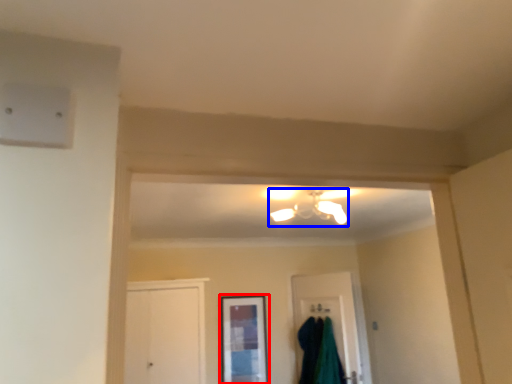
Question: Among these objects, which one is nearest to the camera, window (highlighted by a red box) or light fixture (highlighted by a blue box)?

Choices:
 (A) window
 (B) light fixture

Answer: (B)